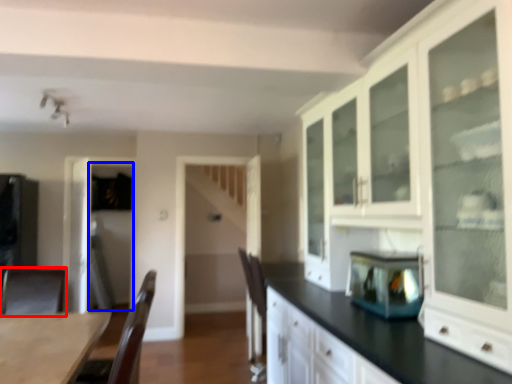
Question: Which object appears closest to the camera in this image, armchair (highlighted by a red box) or glass door (highlighted by a blue box)?

Choices:
 (A) armchair
 (B) glass door

Answer: (A)